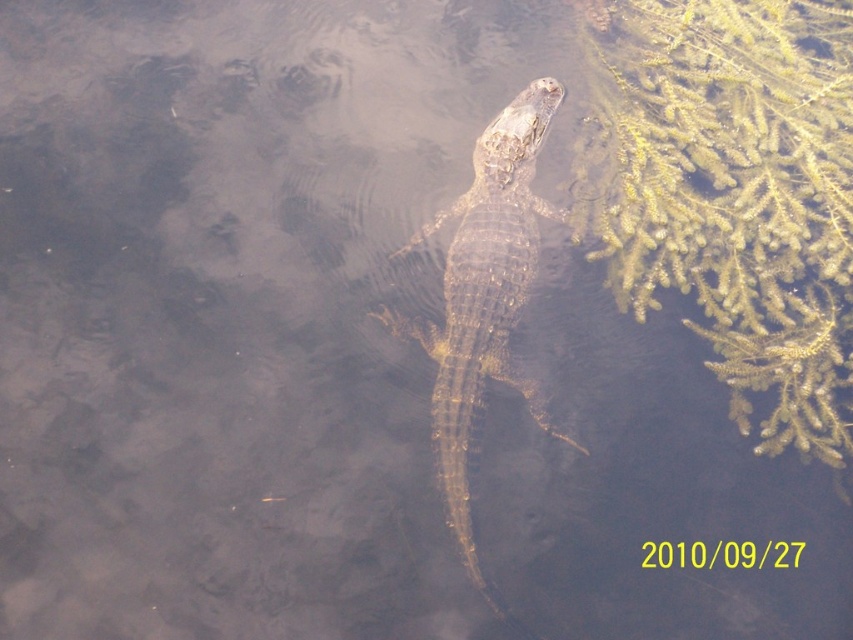
Question: Among these points, which one is farthest from the camera?

Choices:
 (A) (741, 132)
 (B) (474, 339)

Answer: (A)

Question: Is green mossy plant at right above shiny brown crocodile at center?

Choices:
 (A) no
 (B) yes

Answer: (B)

Question: Can you confirm if green mossy plant at right is smaller than shiny brown crocodile at center?

Choices:
 (A) yes
 (B) no

Answer: (B)

Question: Is green mossy plant at right wider than shiny brown crocodile at center?

Choices:
 (A) yes
 (B) no

Answer: (A)

Question: Which point is closer to the camera?

Choices:
 (A) (703, 134)
 (B) (511, 378)

Answer: (B)